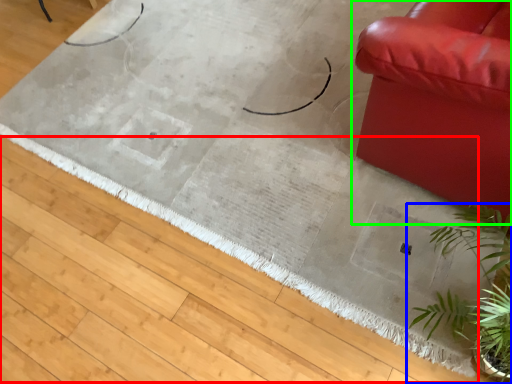
Question: Based on their relative distances, which object is farther from doormat (highlighted by a red box)? Choose from houseplant (highlighted by a blue box) and studio couch (highlighted by a green box).

Choices:
 (A) houseplant
 (B) studio couch

Answer: (B)